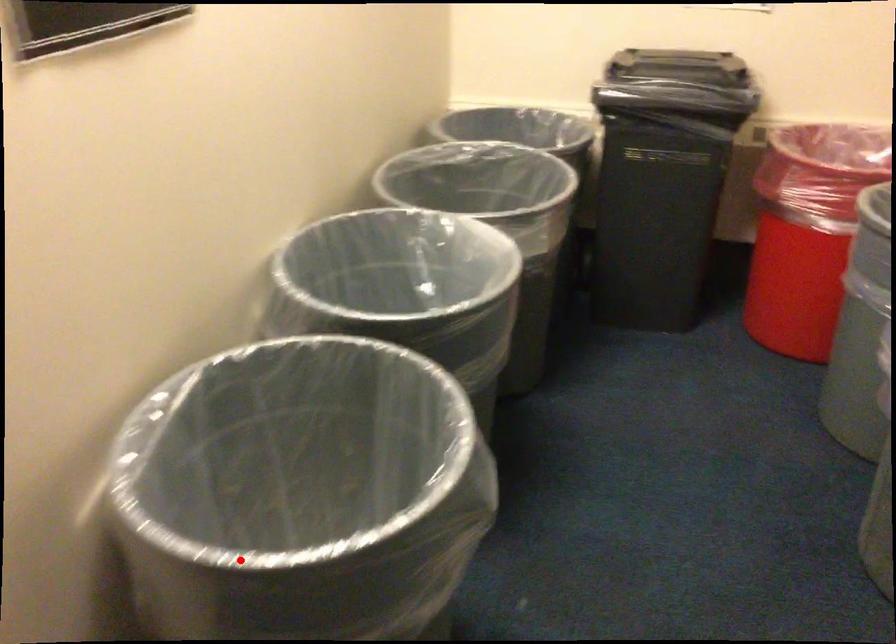
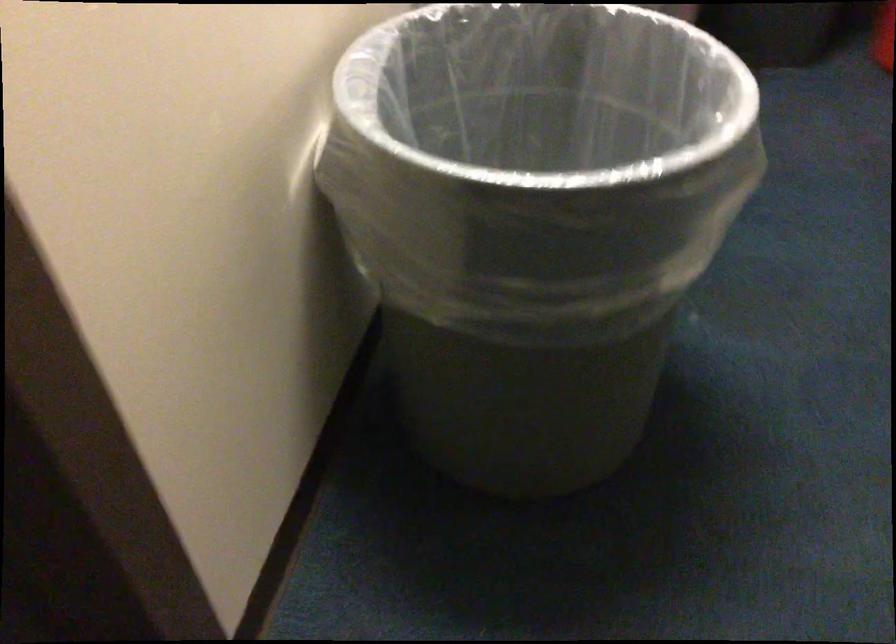
In the second image, find the point that corresponds to the highlighted location in the first image.

(538, 185)